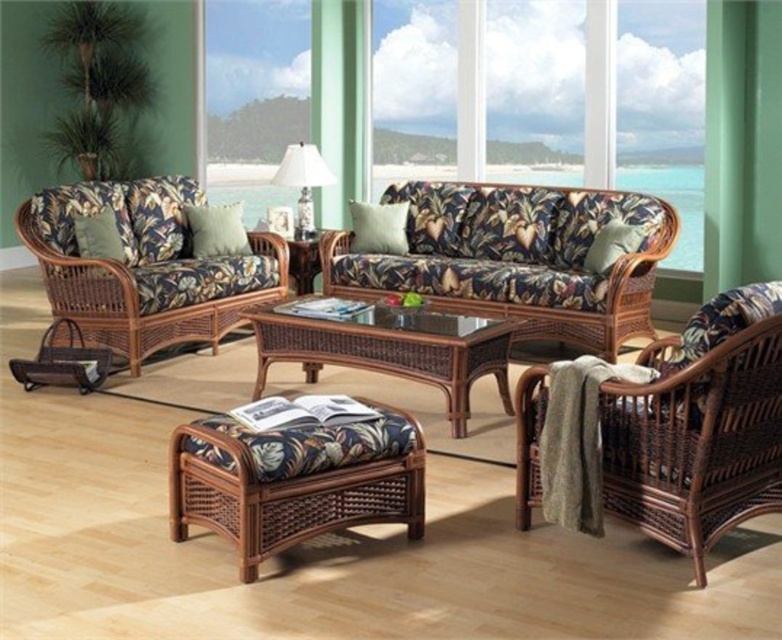
You are standing at the entrance of the living room and want to place a new decorative item exactly where the white glossy table lamp at center is located. According to the coordinates provided, can you confirm the exact location to place it?

The white glossy table lamp at center is located at coordinates point (303, 180), so you should place the new decorative item there.

You are standing at the camera position in the living room and want to turn on the white glossy table lamp at center. Can you reach it without moving your position?

The white glossy table lamp at center is 6.77 meters away from the camera, so you cannot reach it without moving closer.

You are standing in the living room and want to place a small plant between the two points, point 1 at point (300,188) and point 2 at point (612,260). Which point should the plant be closer to in order to be closer to the viewer?

The plant should be closer to point (300,188) because it is closer to the viewer than point (612,260).